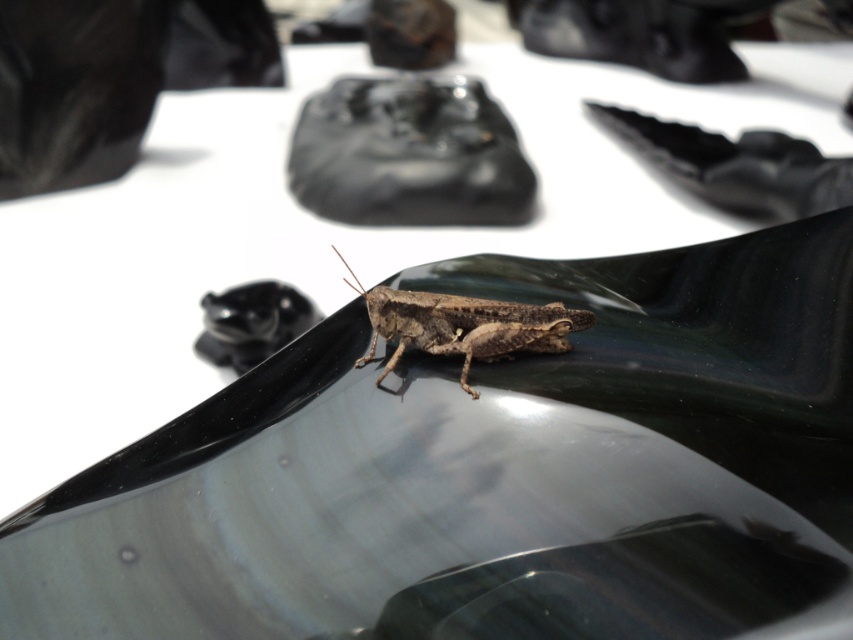
Question: Is black glossy shoe at upper center above brown matte grasshopper at center?

Choices:
 (A) yes
 (B) no

Answer: (A)

Question: Which object is farther from the camera taking this photo?

Choices:
 (A) black glossy shoe at upper center
 (B) brown matte grasshopper at center

Answer: (A)

Question: In this image, where is black glossy shoe at upper center located relative to brown matte grasshopper at center?

Choices:
 (A) above
 (B) below

Answer: (A)

Question: Which point appears closest to the camera in this image?

Choices:
 (A) (741, 189)
 (B) (492, 326)

Answer: (B)

Question: Is black glossy shoe at upper center further to camera compared to brown matte grasshopper at center?

Choices:
 (A) no
 (B) yes

Answer: (B)